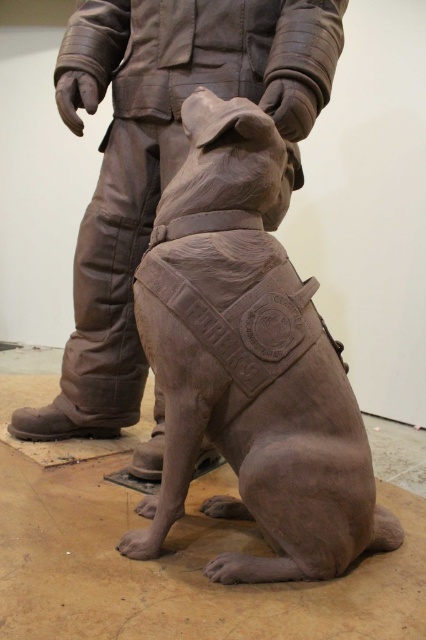
Can you confirm if matte clay dog at center is positioned above matte bronze dog at center?

No.

Between matte clay dog at center and matte bronze dog at center, which one has more height?

With more height is matte bronze dog at center.

Is point (227, 108) positioned behind point (118, 40)?

No, it is not.

Find the location of a particular element. The height and width of the screenshot is (640, 426). matte clay dog at center is located at coordinates (249, 364).